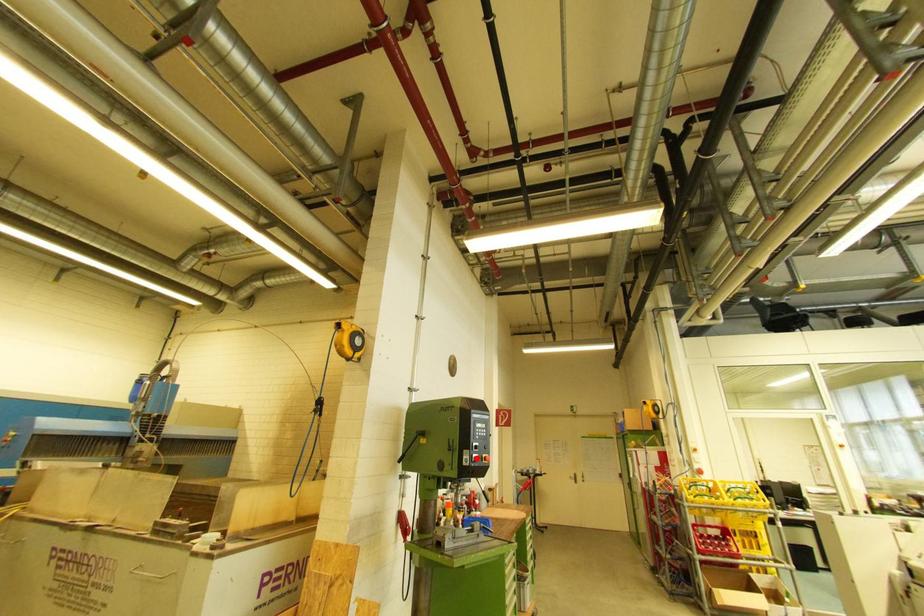
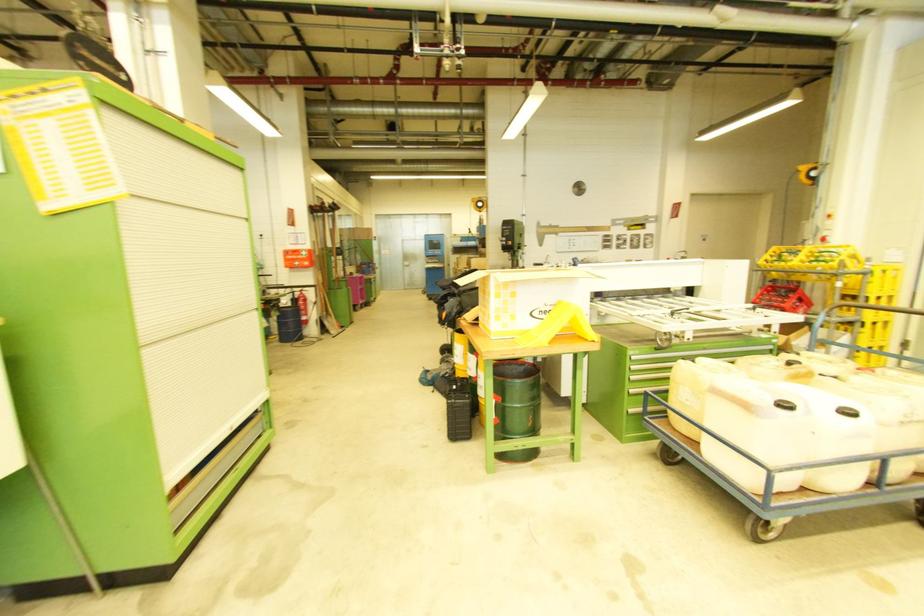
Question: I am providing you with two images of the same scene from different viewpoints. A red point is marked on the first image. Is the red point's position out of view in image 2?

Choices:
 (A) Yes
 (B) No

Answer: (A)